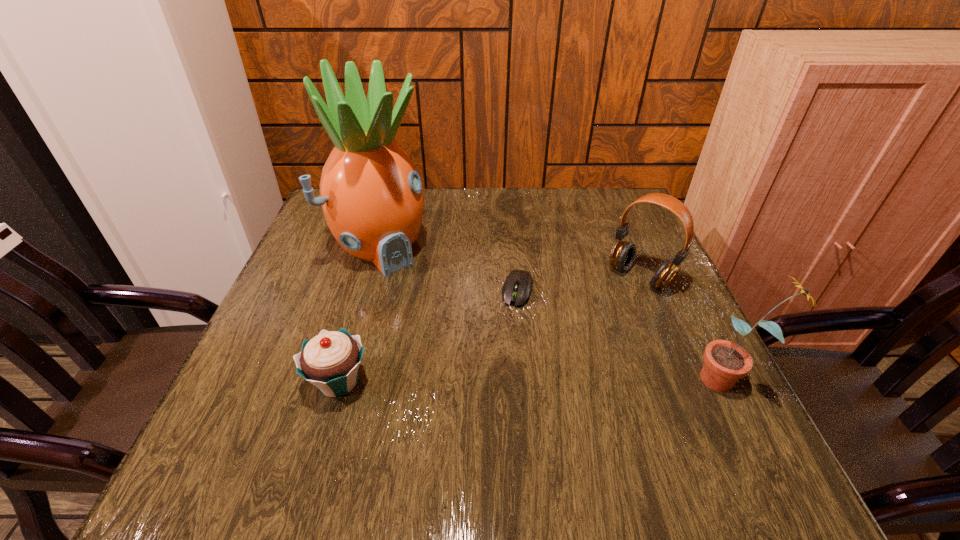
Find the location of a particular element. Image resolution: width=960 pixels, height=540 pixels. free space between the third tallest object and the cupcake is located at coordinates (490, 329).

Find the location of `vacant space in between the headset and the sunflower`. vacant space in between the headset and the sunflower is located at coordinates (684, 328).

The image size is (960, 540). I want to click on empty space between the sunflower and the third shortest object, so click(x=684, y=328).

Image resolution: width=960 pixels, height=540 pixels. I want to click on free space between the third shortest object and the pineapple, so click(x=511, y=261).

Find the location of a particular element. This screenshot has width=960, height=540. object that can be found as the second closest to the third object from left to right is located at coordinates (623, 253).

Select which object is the third closest to the third object from right to left. Please provide its 2D coordinates. Your answer should be formatted as a tuple, i.e. [(x, y)], where the tuple contains the x and y coordinates of a point satisfying the conditions above.

[(330, 361)]

The width and height of the screenshot is (960, 540). In order to click on vacant space that satisfies the following two spatial constraints: 1. on the back side of the cupcake; 2. on the right side of the pineapple in this screenshot , I will do `click(378, 246)`.

Locate an element on the screen. This screenshot has height=540, width=960. vacant space that satisfies the following two spatial constraints: 1. on the front side of the third tallest object; 2. on the right side of the tallest object is located at coordinates (373, 277).

Locate an element on the screen. This screenshot has height=540, width=960. vacant region that satisfies the following two spatial constraints: 1. on the back side of the second shortest object; 2. on the right side of the third shortest object is located at coordinates (369, 277).